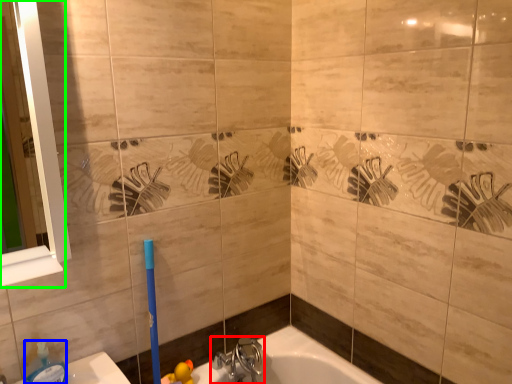
Question: Estimate the real-world distances between objects in this image. Which object is closer to tap (highlighted by a red box), soap dispenser (highlighted by a blue box) or mirror (highlighted by a green box)?

Choices:
 (A) soap dispenser
 (B) mirror

Answer: (A)